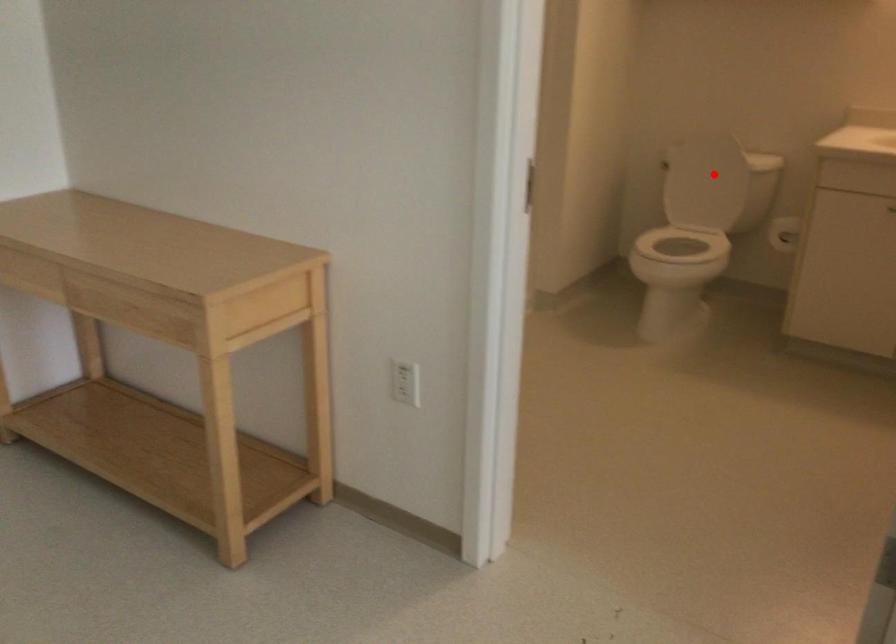
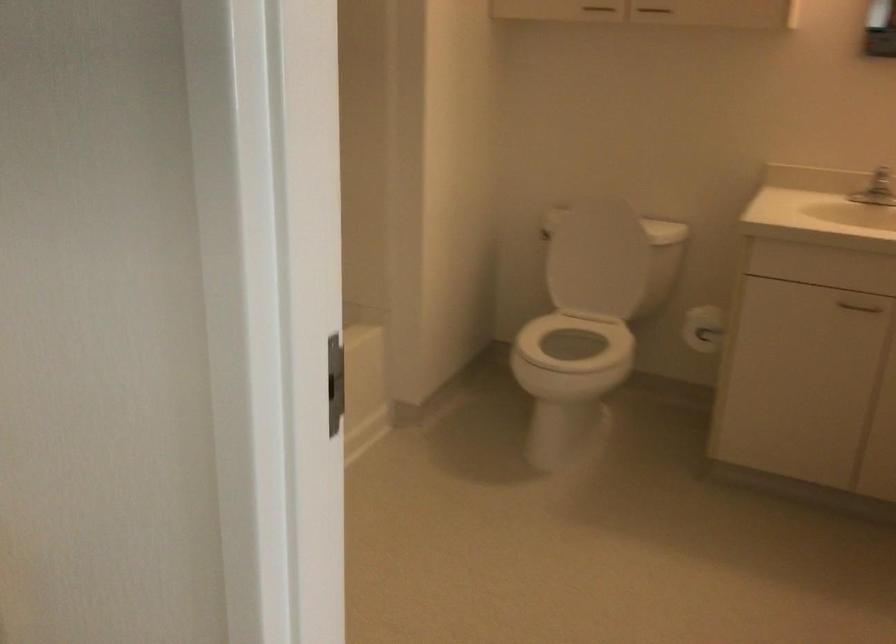
Question: I am providing you with two images of the same scene from different viewpoints. Image1 has a red point marked. In image2, the corresponding 3D location appears at what relative position? Reply with the corresponding letter.

Choices:
 (A) Closer
 (B) Farther

Answer: (A)